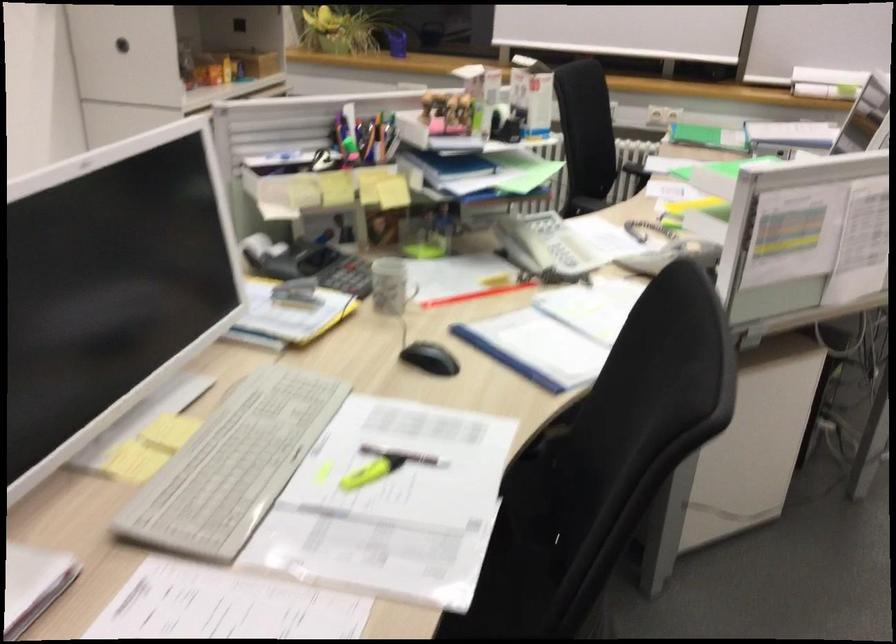
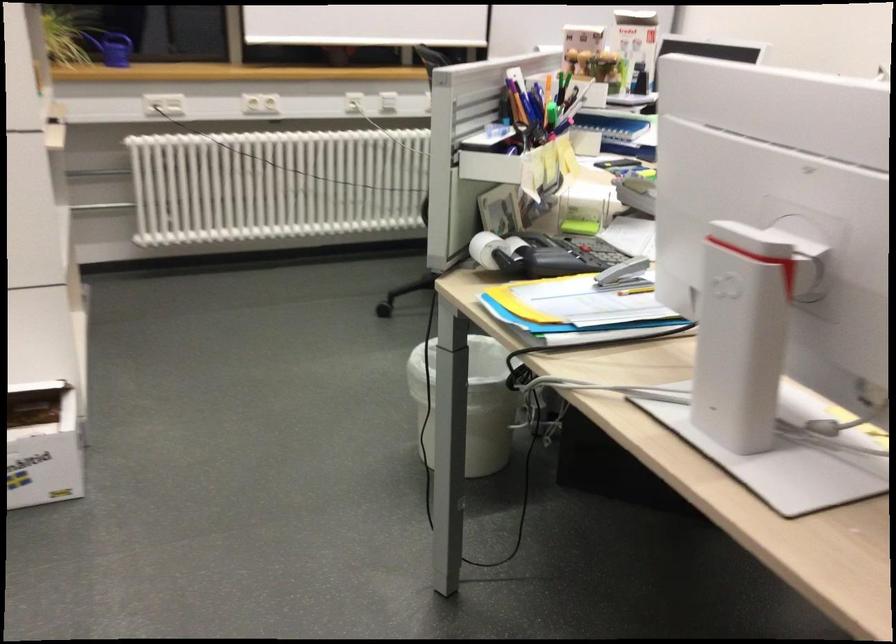
The point at (278, 269) is marked in the first image. Where is the corresponding point in the second image?

(554, 259)